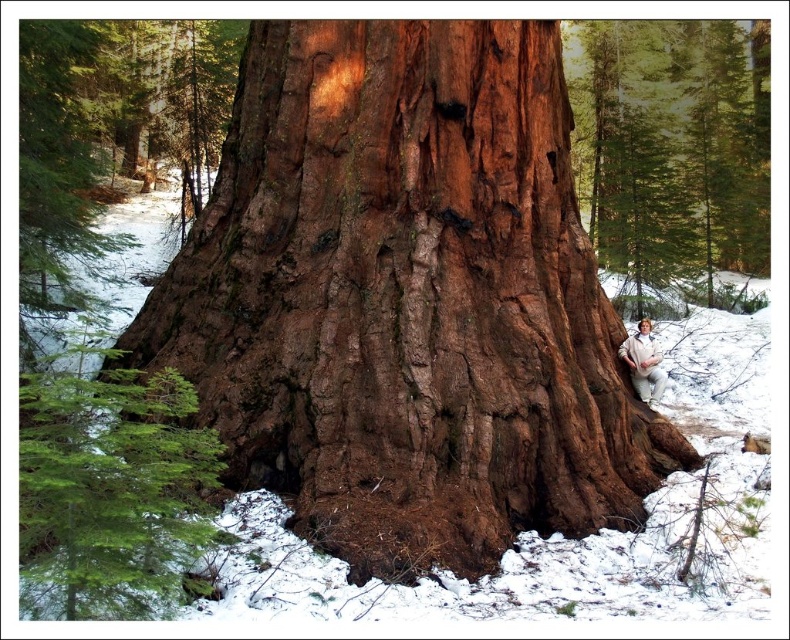
You are standing in front of the massive tree trunk and want to reach the two points marked on the trunk. Which point, point (228,486) or point (21,476), is closer to you?

Point (228,486) is closer to you because it is further to the viewer than point (21,476).

You are a hiker wearing white cotton pants at lower right and standing near a brown rough bark at center. Which object is more to the right?

The white cotton pants at lower right are more to the right than the brown rough bark at center.